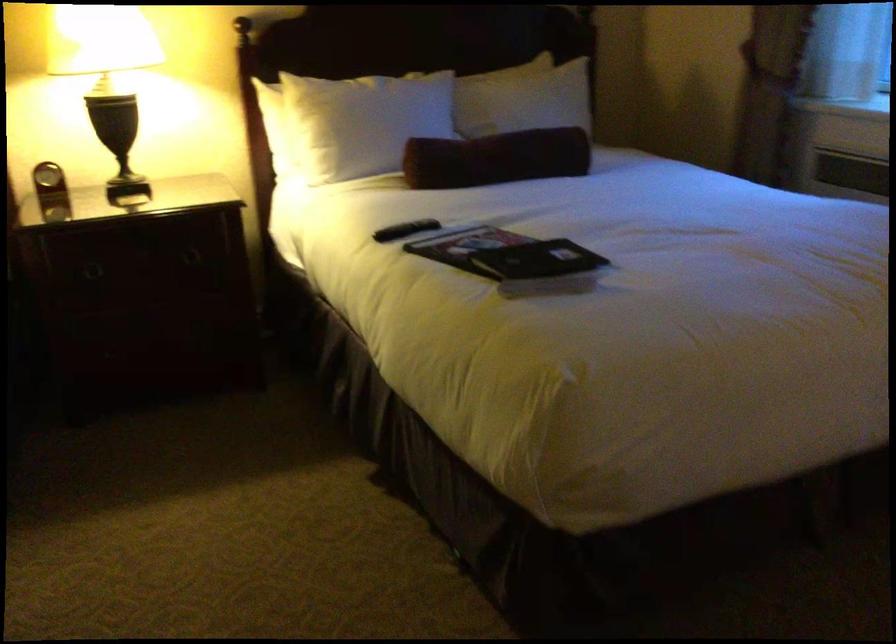
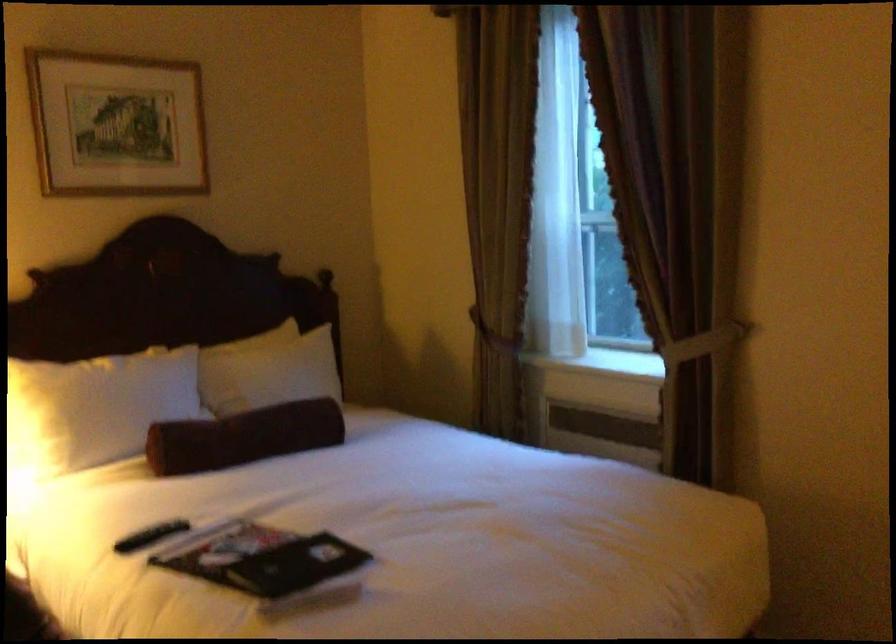
Question: The images are taken continuously from a first-person perspective. In which direction are you moving?

Choices:
 (A) Left
 (B) Right
 (C) Forward
 (D) Backward

Answer: (B)